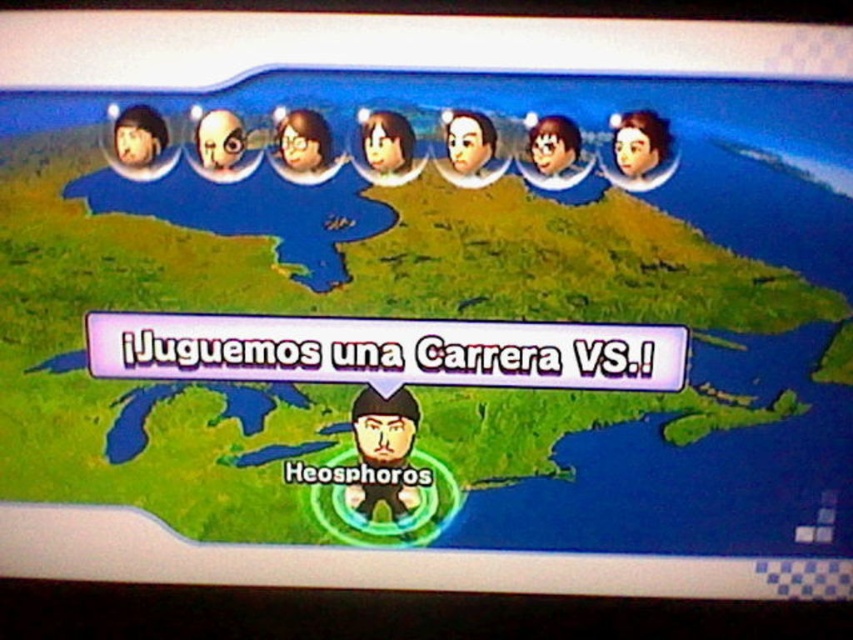
Question: Which object appears farthest from the camera in this image?

Choices:
 (A) smooth brown hair at center
 (B) shiny metallic helmet at upper left
 (C) matte black head at upper center
 (D) smooth gray skull at center

Answer: (A)

Question: Can you confirm if smooth brown hair at center is smaller than matte brown hair at center?

Choices:
 (A) no
 (B) yes

Answer: (A)

Question: Does black matte avatar at center have a larger size compared to smooth brown hair at center?

Choices:
 (A) yes
 (B) no

Answer: (A)

Question: Which point appears farthest from the camera in this image?

Choices:
 (A) (538, 156)
 (B) (132, 136)

Answer: (A)

Question: Does black matte avatar at center appear on the left side of matte brown hair at upper center?

Choices:
 (A) yes
 (B) no

Answer: (B)

Question: Which of the following is the farthest from the observer?

Choices:
 (A) (663, 161)
 (B) (532, 154)
 (C) (157, 124)

Answer: (B)